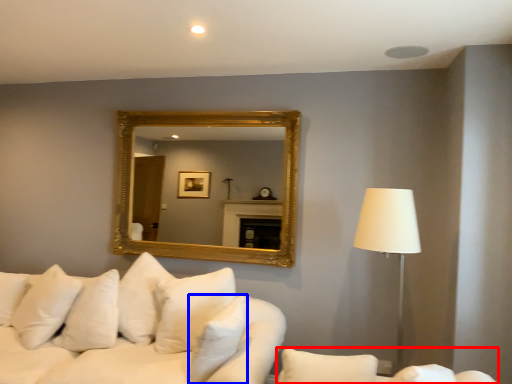
Question: Among these objects, which one is farthest to the camera, couch (highlighted by a red box) or pillow (highlighted by a blue box)?

Choices:
 (A) couch
 (B) pillow

Answer: (B)